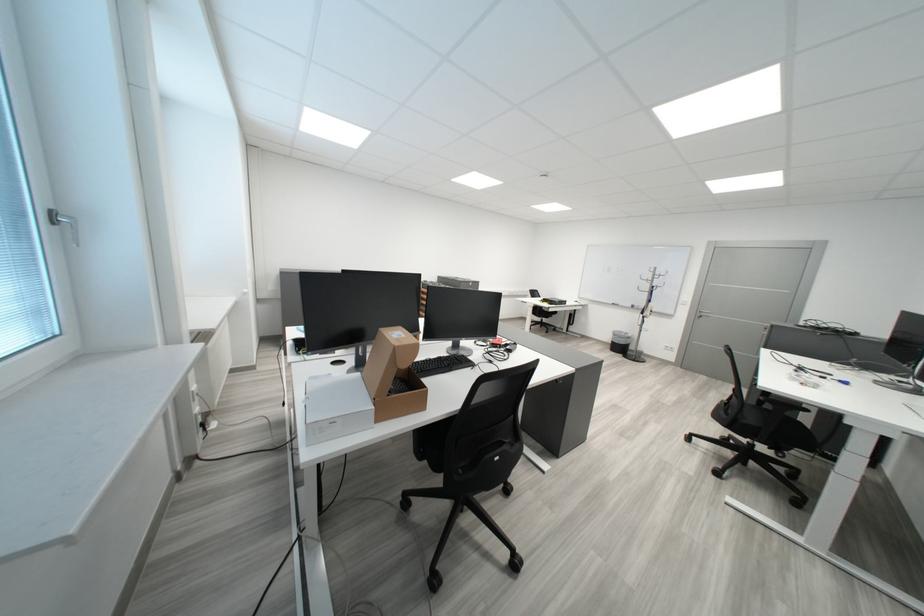
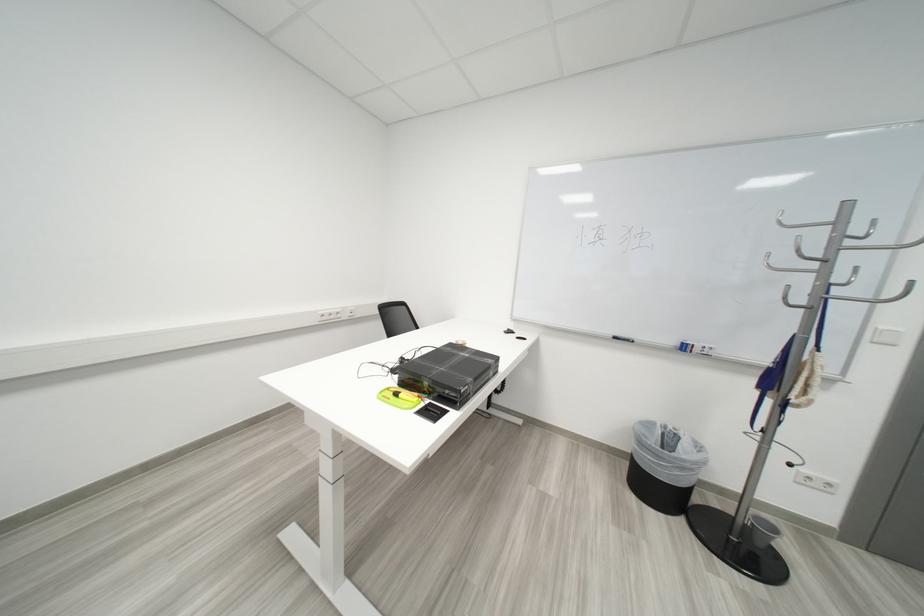
Where in the second image is the point corresponding to point 667,277 from the first image?

(853, 238)